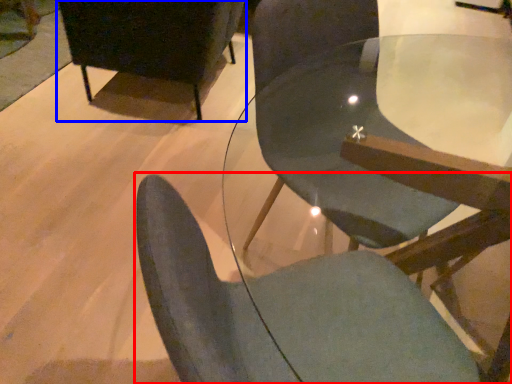
Question: Which of the following is the closest to the observer, chair (highlighted by a red box) or chair (highlighted by a blue box)?

Choices:
 (A) chair
 (B) chair

Answer: (A)